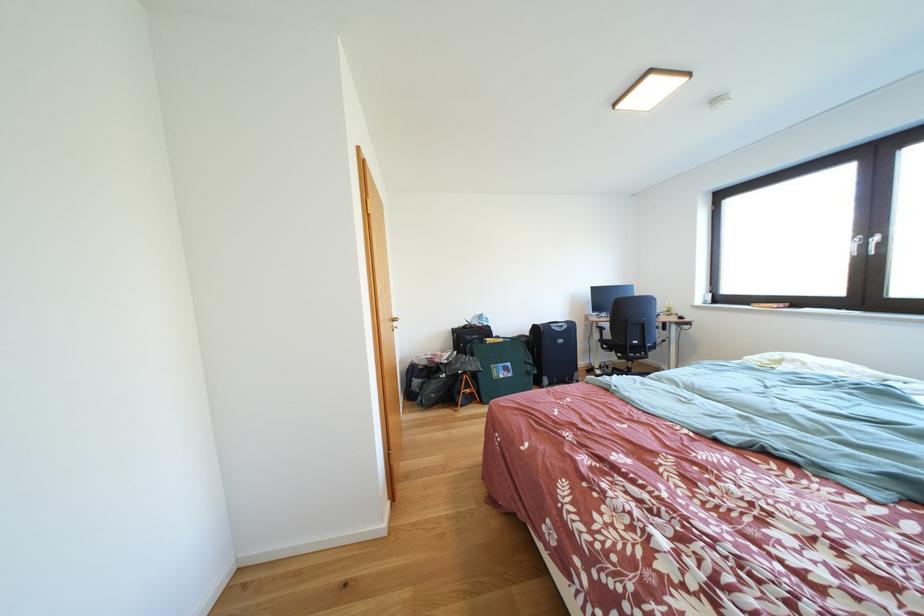
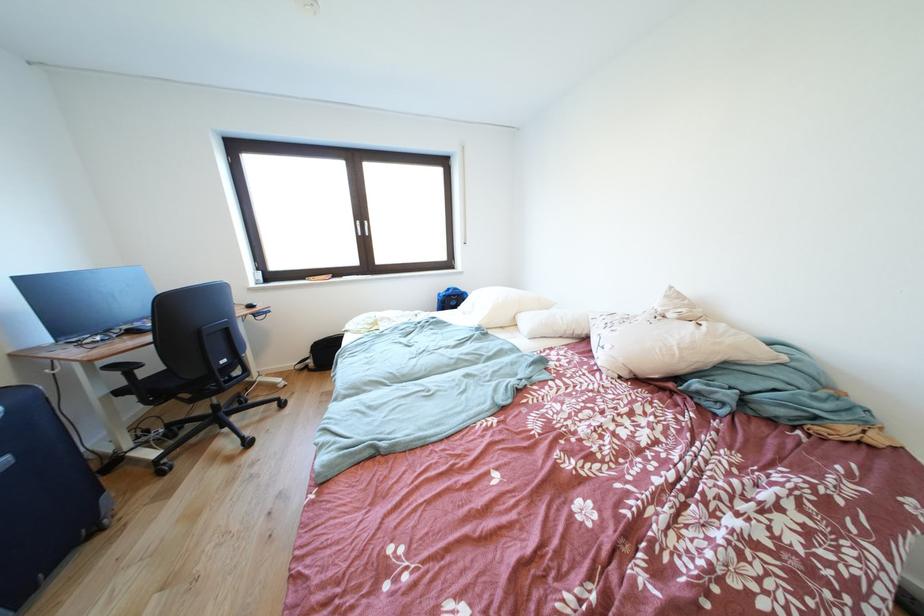
The point at (608, 331) is marked in the first image. Where is the corresponding point in the second image?

(120, 371)